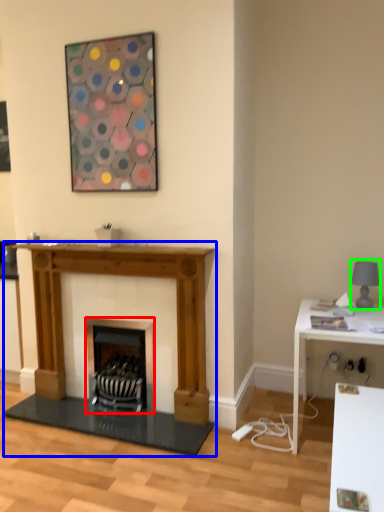
Question: Based on their relative distances, which object is nearer to wood burning stove (highlighted by a red box)? Choose from fireplace (highlighted by a blue box) and lamp (highlighted by a green box).

Choices:
 (A) fireplace
 (B) lamp

Answer: (A)